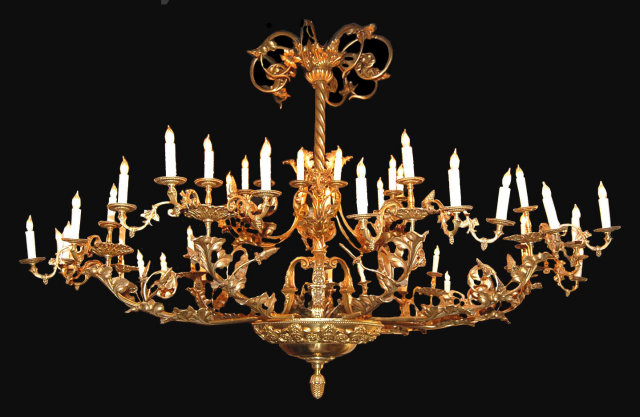
You are a GUI agent. You are given a task and a screenshot of the screen. Output one action in this format:
    pyautogui.click(x=<x>, y=<y>)
    Task: Click on the right point of chandelier
    The width and height of the screenshot is (640, 417).
    Given the screenshot: What is the action you would take?
    pyautogui.click(x=608, y=235)